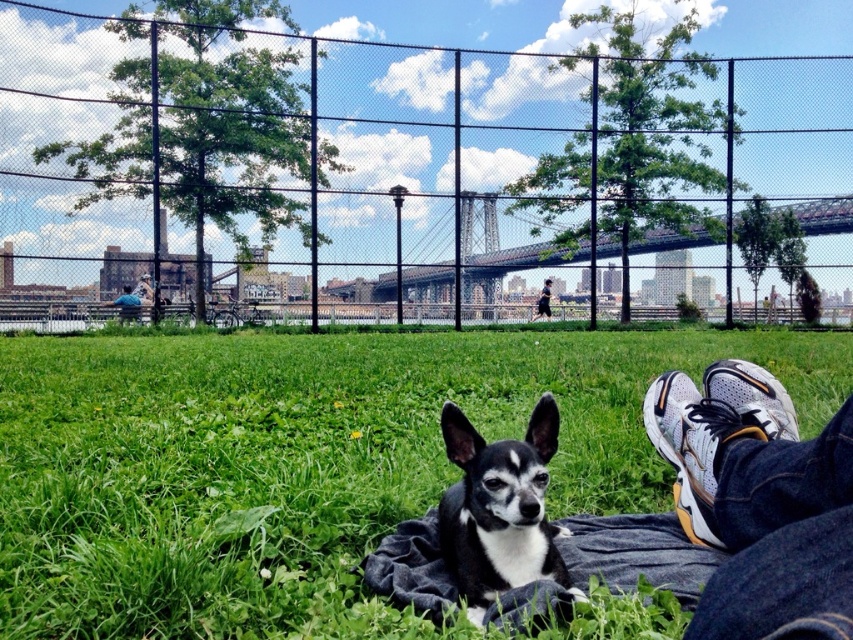
You are a photographer trying to capture both the white mesh sneakers at lower right and the black and white fur dog at center in a single shot. Since you want both subjects to be clearly visible, which one should you focus on first to ensure depth of field?

Since the white mesh sneakers at lower right is taller than the black and white fur dog at center, you should focus on the white mesh sneakers at lower right first to ensure both are in focus.